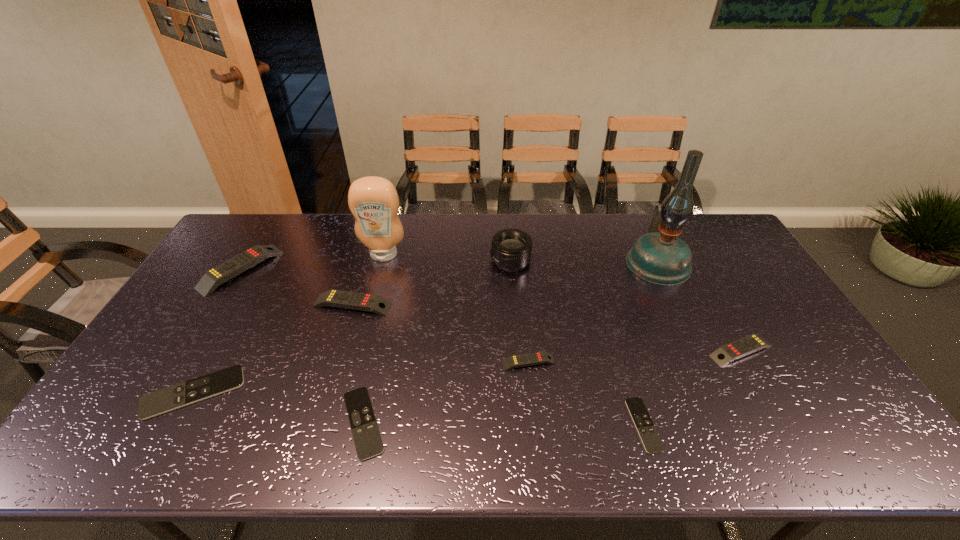
Point out which object is positioned as the seventh nearest to the third tallest object. Please provide its 2D coordinates. Your answer should be formatted as a tuple, i.e. [(x, y)], where the tuple contains the x and y coordinates of a point satisfying the conditions above.

[(737, 349)]

At what (x,y) coordinates should I click in order to perform the action: click on object that is the ninth closest to the tallest object. Please return your answer as a coordinate pair (x, y). Image resolution: width=960 pixels, height=540 pixels. Looking at the image, I should click on (218, 275).

Locate an element on the screen. This screenshot has height=540, width=960. remote control that is the sixth closest one to the condiment is located at coordinates (652, 443).

Select which remote control is the third closest to the condiment. Please provide its 2D coordinates. Your answer should be formatted as a tuple, i.e. [(x, y)], where the tuple contains the x and y coordinates of a point satisfying the conditions above.

[(173, 397)]

Select which yellow remote control appears as the second closest to the second tallest remote control. Please provide its 2D coordinates. Your answer should be formatted as a tuple, i.e. [(x, y)], where the tuple contains the x and y coordinates of a point satisfying the conditions above.

[(530, 359)]

Image resolution: width=960 pixels, height=540 pixels. What are the coordinates of `yellow remote control object that ranks as the closest to the third yellow remote control from right to left` in the screenshot? It's located at (218, 275).

At what (x,y) coordinates should I click in order to perform the action: click on black remote control that is the closest to the biggest yellow remote control. Please return your answer as a coordinate pair (x, y). This screenshot has height=540, width=960. Looking at the image, I should click on (173, 397).

Identify which black remote control is the nearest to the rightmost black remote control. Please provide its 2D coordinates. Your answer should be formatted as a tuple, i.e. [(x, y)], where the tuple contains the x and y coordinates of a point satisfying the conditions above.

[(366, 436)]

The image size is (960, 540). In order to click on free space that satisfies the following two spatial constraints: 1. on the back side of the second yellow remote control from right to left; 2. on the left side of the second black remote control from left to right in this screenshot , I will do `click(376, 362)`.

Identify the location of blank space that satisfies the following two spatial constraints: 1. on the label of the condiment; 2. on the right side of the smallest black remote control. (340, 425).